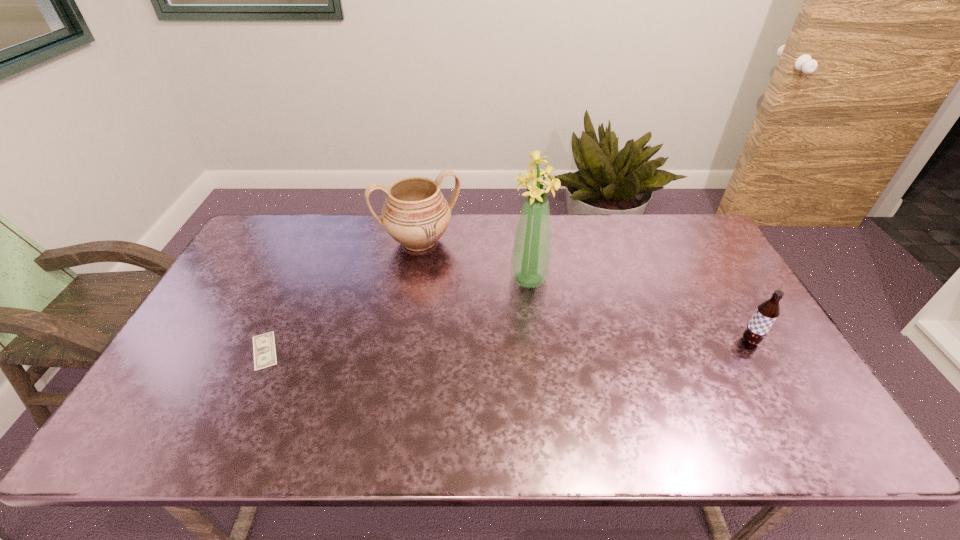
This screenshot has height=540, width=960. What are the coordinates of `the shortest object` in the screenshot? It's located at (264, 350).

This screenshot has height=540, width=960. What are the coordinates of `money` in the screenshot? It's located at (264, 350).

The width and height of the screenshot is (960, 540). Identify the location of the second shortest object. (767, 312).

Identify the location of root beer. Image resolution: width=960 pixels, height=540 pixels. (767, 312).

Find the location of a particular element. Image resolution: width=960 pixels, height=540 pixels. the farthest object is located at coordinates (415, 214).

Identify the location of urn. (415, 214).

Image resolution: width=960 pixels, height=540 pixels. I want to click on the third nearest object, so [x=530, y=260].

The image size is (960, 540). What are the coordinates of `the tallest object` in the screenshot? It's located at (530, 260).

Locate an element on the screen. vacant space located 0.210m on the back of the money is located at coordinates (297, 280).

Identify the location of vacant area located on the left of the root beer. The height and width of the screenshot is (540, 960). (644, 341).